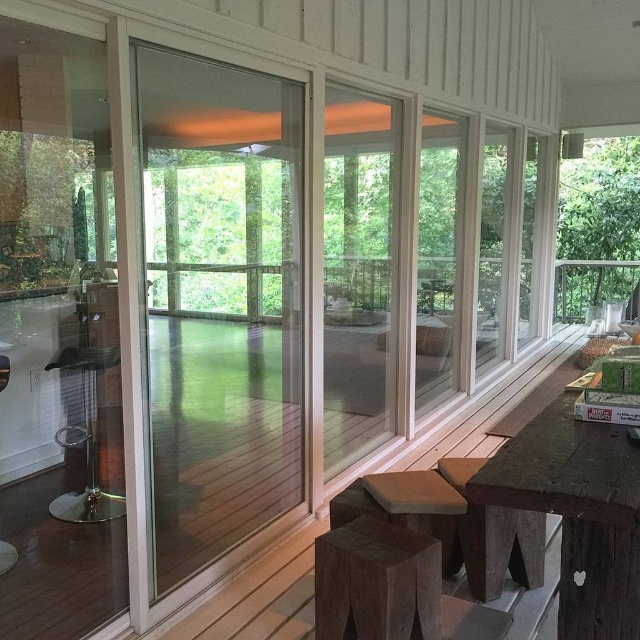
You are standing inside the sunroom and want to exit through the transparent glass screen door at left. However, you notice that the clear glass window at center is directly above it. Could the window at center be an obstacle when opening the door?

The transparent glass screen door at left is positioned under the clear glass window at center, so opening the door should not be obstructed by the window since it is located below it.

You are planning to place a potted plant on the transparent glass deck at center, but you need to ensure it won not block the view of the brown wooden table at lower right. Can you confirm if the deck is above or below the table?

The brown wooden table at lower right is below the transparent glass deck at center, so placing the plant on the deck will not block the view of the table since the deck is above it.